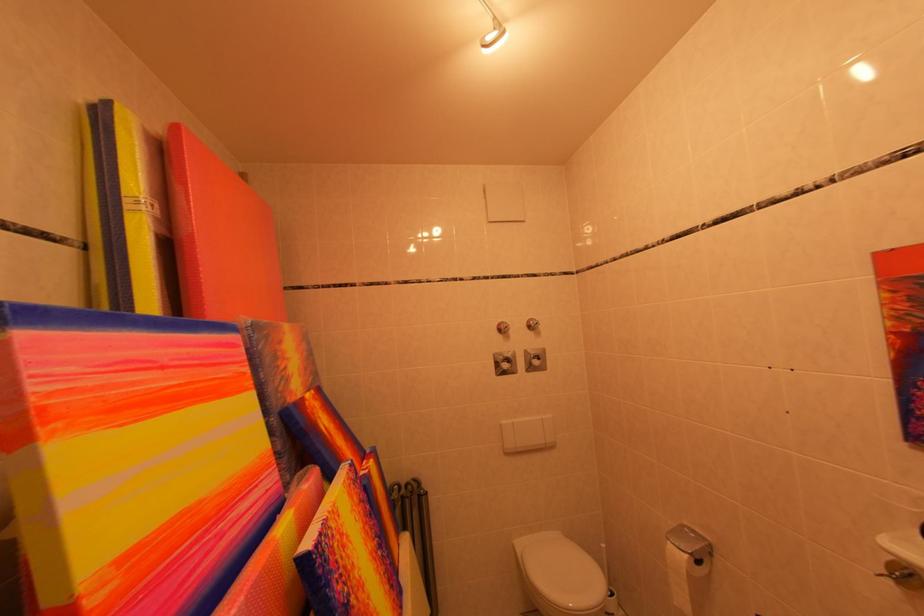
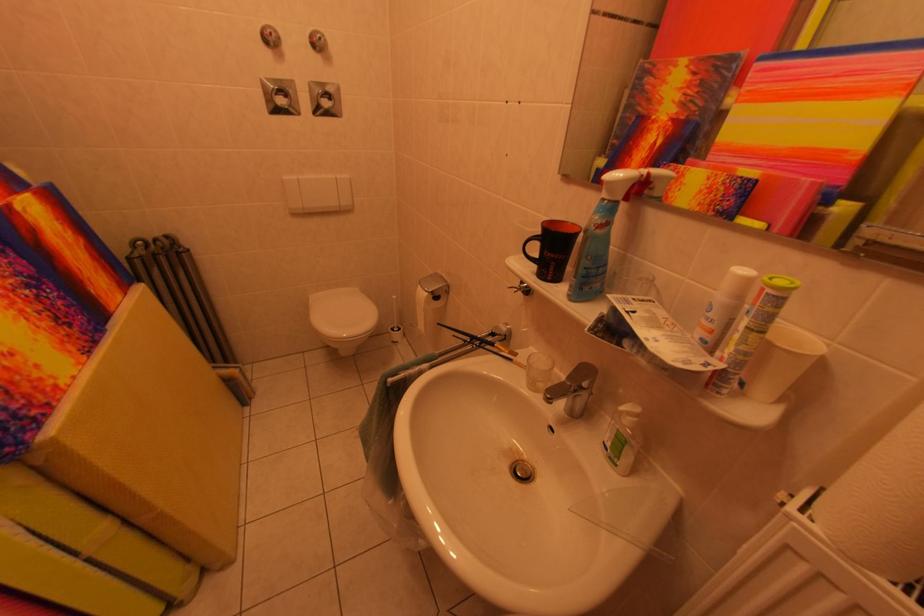
Locate, in the second image, the point that corresponds to (x=678, y=549) in the first image.

(429, 292)